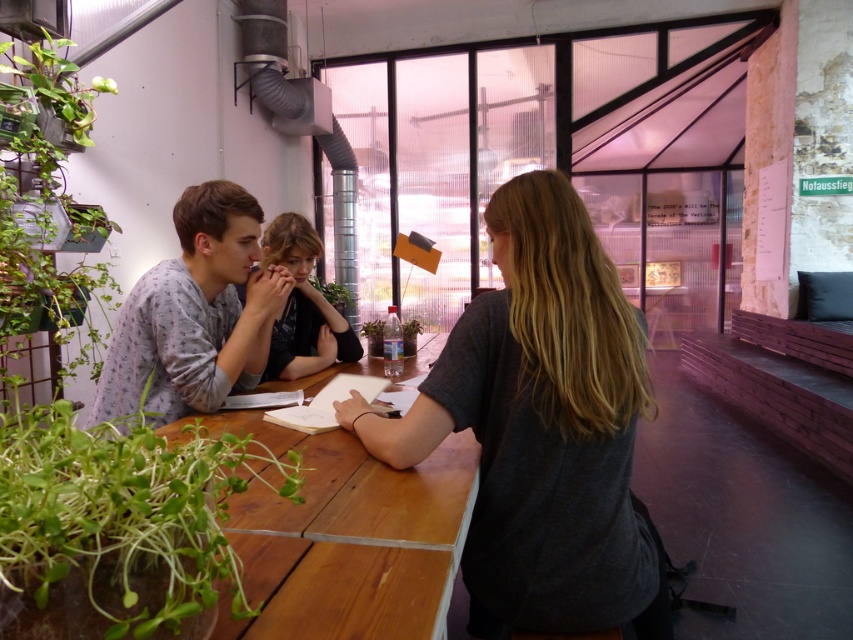
Question: From the image, what is the correct spatial relationship of wooden table at center in relation to green glossy pitcher plant at upper left?

Choices:
 (A) right
 (B) left

Answer: (A)

Question: Which point appears closest to the camera in this image?

Choices:
 (A) (0, 308)
 (B) (288, 262)
 (C) (44, 572)

Answer: (C)

Question: Which of the following is the farthest from the observer?

Choices:
 (A) (61, 45)
 (B) (310, 332)
 (C) (28, 625)
 (D) (213, 376)

Answer: (A)

Question: Does light gray pajama top at center have a lesser width compared to green glossy pitcher plant at upper left?

Choices:
 (A) no
 (B) yes

Answer: (A)

Question: Is the position of dark gray t-shirt at center more distant than that of wooden table at center?

Choices:
 (A) yes
 (B) no

Answer: (A)

Question: Among these objects, which one is farthest from the camera?

Choices:
 (A) matte black hair at center
 (B) dark gray t-shirt at center

Answer: (A)